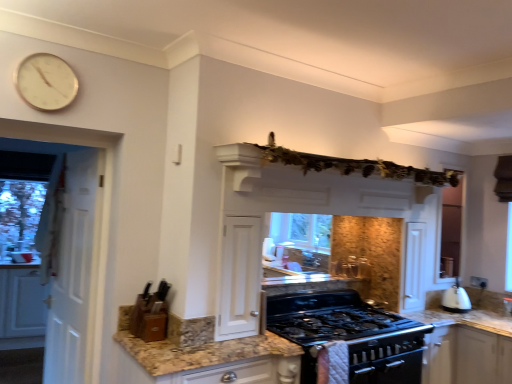
Question: From the image's perspective, does wooden knife block at lower left, positioned as the second appliance in right-to-left order, appear higher than white matte cabinet at left?

Choices:
 (A) yes
 (B) no

Answer: (A)

Question: Is wooden knife block at lower left, the 2th appliance when ordered from bottom to top, oriented away from white matte cabinet at left?

Choices:
 (A) no
 (B) yes

Answer: (B)

Question: Can you confirm if wooden knife block at lower left, positioned as the second appliance in right-to-left order, is positioned to the right of white matte cabinet at left?

Choices:
 (A) yes
 (B) no

Answer: (A)

Question: Is there a large distance between wooden knife block at lower left, the 2th appliance when ordered from bottom to top, and white matte cabinet at left?

Choices:
 (A) no
 (B) yes

Answer: (B)

Question: Is wooden knife block at lower left, arranged as the first appliance when viewed from the left, closer to the viewer compared to white matte cabinet at left?

Choices:
 (A) no
 (B) yes

Answer: (B)

Question: From a real-world perspective, is wooden knife block at lower left, the 2th appliance when ordered from bottom to top, located higher than white matte cabinet at left?

Choices:
 (A) no
 (B) yes

Answer: (B)

Question: Considering the relative sizes of white matte exhaust hood at upper center and granite at left in the image provided, is white matte exhaust hood at upper center shorter than granite at left?

Choices:
 (A) no
 (B) yes

Answer: (B)

Question: Can you confirm if white matte exhaust hood at upper center is thinner than granite at left?

Choices:
 (A) yes
 (B) no

Answer: (A)

Question: Is white matte exhaust hood at upper center looking in the opposite direction of granite at left?

Choices:
 (A) yes
 (B) no

Answer: (B)

Question: Does white matte exhaust hood at upper center have a greater height compared to granite at left?

Choices:
 (A) no
 (B) yes

Answer: (A)

Question: Does white matte exhaust hood at upper center appear on the left side of granite at left?

Choices:
 (A) yes
 (B) no

Answer: (B)

Question: From a real-world perspective, is white matte exhaust hood at upper center physically above granite at left?

Choices:
 (A) yes
 (B) no

Answer: (A)

Question: From the image's perspective, is white matte exhaust hood at upper center located beneath black matte gas stove at center, which ranks as the 1th appliance in bottom-to-top order?

Choices:
 (A) no
 (B) yes

Answer: (A)